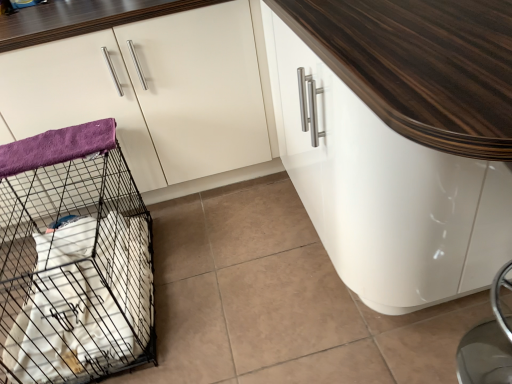
Question: Should I look upward or downward to see white glossy cabinet at upper left, arranged as the 2th cabinetry when viewed from the right?

Choices:
 (A) up
 (B) down

Answer: (A)

Question: Is purple fleece blanket at left facing towards white glossy cabinet at upper left, arranged as the 2th cabinetry when viewed from the right?

Choices:
 (A) no
 (B) yes

Answer: (A)

Question: Is purple fleece blanket at left to the right of white glossy cabinet at upper left, positioned as the 1th cabinetry in left-to-right order, from the viewer's perspective?

Choices:
 (A) no
 (B) yes

Answer: (A)

Question: Considering the relative sizes of purple fleece blanket at left and white glossy cabinet at upper left, positioned as the 1th cabinetry in left-to-right order, in the image provided, is purple fleece blanket at left thinner than white glossy cabinet at upper left, positioned as the 1th cabinetry in left-to-right order,?

Choices:
 (A) no
 (B) yes

Answer: (B)

Question: Is purple fleece blanket at left bigger than white glossy cabinet at upper left, arranged as the 2th cabinetry when viewed from the right?

Choices:
 (A) yes
 (B) no

Answer: (B)

Question: From the image's perspective, is purple fleece blanket at left under white glossy cabinet at upper left, arranged as the 2th cabinetry when viewed from the right?

Choices:
 (A) no
 (B) yes

Answer: (B)

Question: Considering the relative sizes of purple fleece blanket at left and white glossy cabinet at upper left, positioned as the 1th cabinetry in left-to-right order, in the image provided, is purple fleece blanket at left smaller than white glossy cabinet at upper left, positioned as the 1th cabinetry in left-to-right order,?

Choices:
 (A) yes
 (B) no

Answer: (A)

Question: Are black wire mesh cage at left and white glossy cabinet at center, the 2th cabinetry viewed from the left, located far from each other?

Choices:
 (A) no
 (B) yes

Answer: (A)

Question: Is black wire mesh cage at left positioned behind white glossy cabinet at center, the 2th cabinetry viewed from the left?

Choices:
 (A) yes
 (B) no

Answer: (A)

Question: Can we say black wire mesh cage at left lies outside white glossy cabinet at center, which is counted as the first cabinetry, starting from the right?

Choices:
 (A) yes
 (B) no

Answer: (A)

Question: Considering the relative sizes of black wire mesh cage at left and white glossy cabinet at center, which is counted as the first cabinetry, starting from the right, in the image provided, is black wire mesh cage at left shorter than white glossy cabinet at center, which is counted as the first cabinetry, starting from the right,?

Choices:
 (A) no
 (B) yes

Answer: (B)

Question: Can you confirm if black wire mesh cage at left is bigger than white glossy cabinet at center, the 2th cabinetry viewed from the left?

Choices:
 (A) no
 (B) yes

Answer: (A)

Question: From the image's perspective, is black wire mesh cage at left under white glossy cabinet at center, the 2th cabinetry viewed from the left?

Choices:
 (A) yes
 (B) no

Answer: (A)

Question: From the image's perspective, does white glossy cabinet at upper left, arranged as the 2th cabinetry when viewed from the right, appear lower than white glossy cabinet at center, which is counted as the first cabinetry, starting from the right?

Choices:
 (A) no
 (B) yes

Answer: (A)